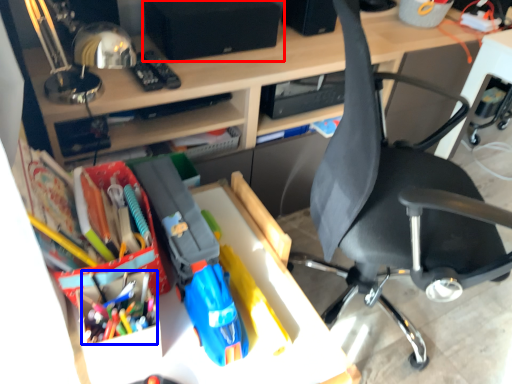
Question: Among these objects, which one is farthest to the camera, speaker (highlighted by a red box) or stationery (highlighted by a blue box)?

Choices:
 (A) speaker
 (B) stationery

Answer: (A)